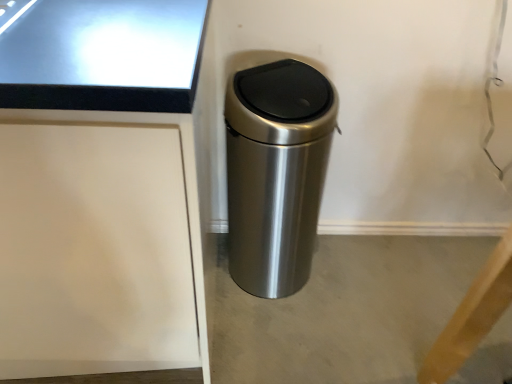
Question: Is gray concrete at center not inside satin silver trash can at center?

Choices:
 (A) yes
 (B) no

Answer: (A)

Question: Would you say gray concrete at center contains satin silver trash can at center?

Choices:
 (A) no
 (B) yes

Answer: (A)

Question: From the image's perspective, is gray concrete at center below satin silver trash can at center?

Choices:
 (A) yes
 (B) no

Answer: (A)

Question: Does gray concrete at center come in front of satin silver trash can at center?

Choices:
 (A) yes
 (B) no

Answer: (B)

Question: From a real-world perspective, is gray concrete at center on top of satin silver trash can at center?

Choices:
 (A) yes
 (B) no

Answer: (B)

Question: From a real-world perspective, is gray concrete at center physically below satin silver trash can at center?

Choices:
 (A) no
 (B) yes

Answer: (B)

Question: Is satin silver trash can at center outside of gray concrete at center?

Choices:
 (A) yes
 (B) no

Answer: (A)

Question: Considering the relative sizes of satin silver trash can at center and gray concrete at center in the image provided, is satin silver trash can at center taller than gray concrete at center?

Choices:
 (A) yes
 (B) no

Answer: (A)

Question: Considering the relative sizes of satin silver trash can at center and gray concrete at center in the image provided, is satin silver trash can at center wider than gray concrete at center?

Choices:
 (A) yes
 (B) no

Answer: (B)

Question: Can you confirm if satin silver trash can at center is shorter than gray concrete at center?

Choices:
 (A) yes
 (B) no

Answer: (B)

Question: Can you confirm if satin silver trash can at center is bigger than gray concrete at center?

Choices:
 (A) yes
 (B) no

Answer: (A)

Question: Is satin silver trash can at center facing towards gray concrete at center?

Choices:
 (A) yes
 (B) no

Answer: (B)

Question: Choose the correct answer: Is gray concrete at center inside satin silver trash can at center or outside it?

Choices:
 (A) outside
 (B) inside

Answer: (A)